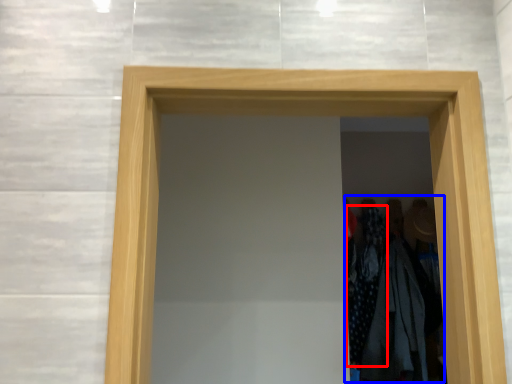
Question: Which of the following is the closest to the observer, clothing (highlighted by a red box) or laundry (highlighted by a blue box)?

Choices:
 (A) clothing
 (B) laundry

Answer: (B)